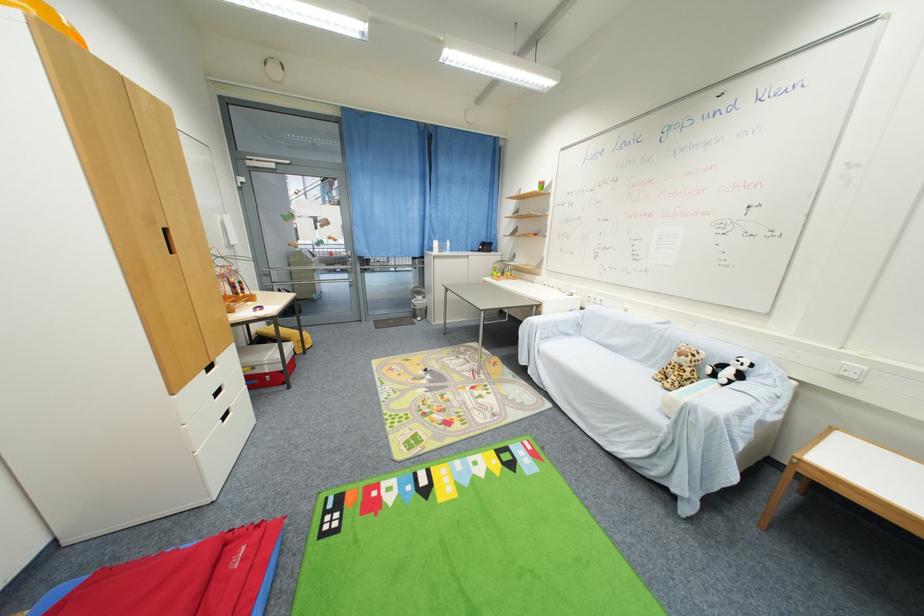
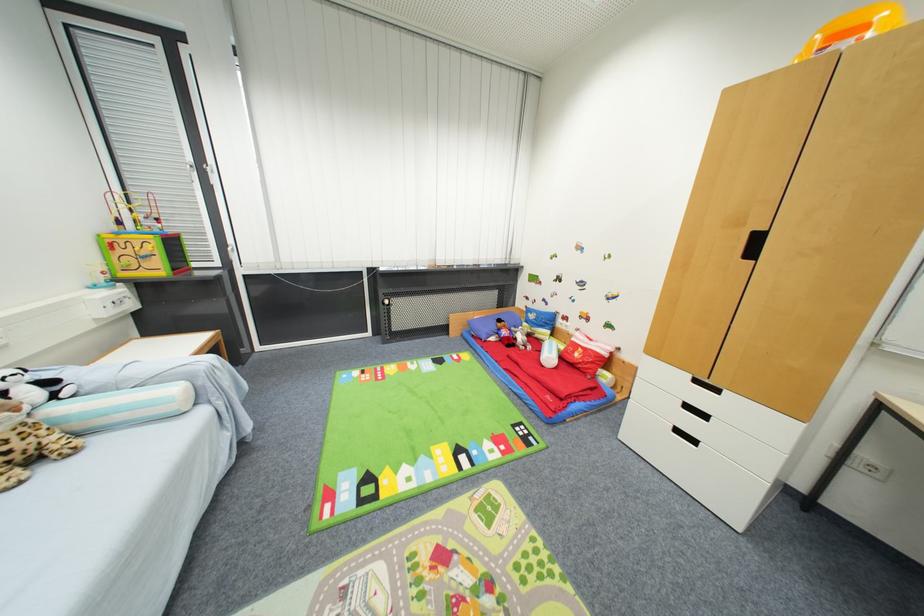
In the second image, find the point that corresponds to (x=746, y=379) in the first image.

(54, 384)